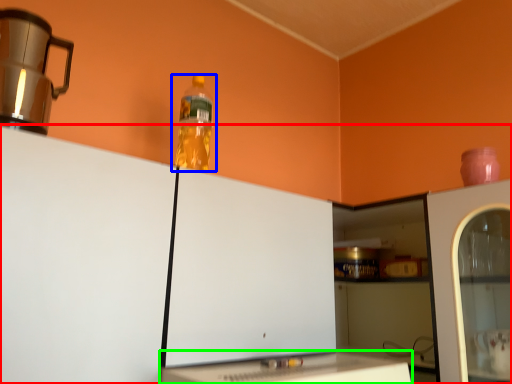
Question: Which is farther away from cabinetry (highlighted by a red box)? bottle (highlighted by a blue box) or table (highlighted by a green box)?

Choices:
 (A) bottle
 (B) table

Answer: (A)